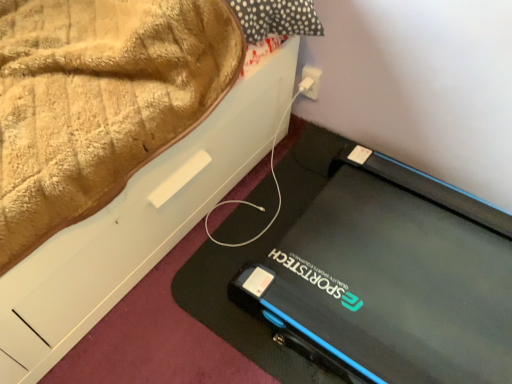
The image size is (512, 384). In order to click on free spot above black rubber mat at lower right (from a real-world perspective) in this screenshot , I will do `click(202, 289)`.